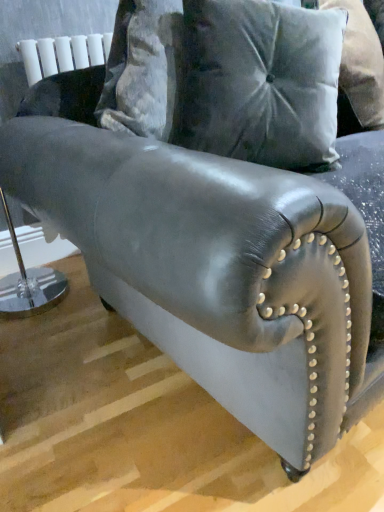
What do you see at coordinates (260, 82) in the screenshot? This screenshot has height=512, width=384. I see `satin gray pillow at upper center` at bounding box center [260, 82].

This screenshot has width=384, height=512. I want to click on satin gray pillow at upper center, so click(x=260, y=82).

What is the approximate height of satin gray pillow at upper center?

It is 15.86 inches.

At what (x,y) coordinates should I click in order to perform the action: click on satin gray pillow at upper center. Please return your answer as a coordinate pair (x, y). The width and height of the screenshot is (384, 512). Looking at the image, I should click on (260, 82).